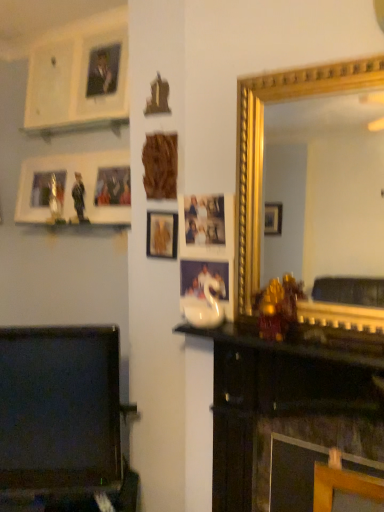
Question: Is black glossy mantle at center taller than wooden carving at center, placed as the 1th picture frame when sorted from front to back?

Choices:
 (A) no
 (B) yes

Answer: (A)

Question: Is black glossy mantle at center aimed at wooden carving at center, marked as the third picture frame in a back-to-front arrangement?

Choices:
 (A) no
 (B) yes

Answer: (A)

Question: Can you confirm if black glossy mantle at center is shorter than wooden carving at center, marked as the third picture frame in a back-to-front arrangement?

Choices:
 (A) yes
 (B) no

Answer: (A)

Question: Does black glossy mantle at center appear on the right side of wooden carving at center, placed as the 2th picture frame when sorted from left to right?

Choices:
 (A) no
 (B) yes

Answer: (B)

Question: Considering the relative sizes of black glossy mantle at center and wooden carving at center, placed as the 2th picture frame when sorted from left to right, in the image provided, is black glossy mantle at center smaller than wooden carving at center, placed as the 2th picture frame when sorted from left to right,?

Choices:
 (A) yes
 (B) no

Answer: (B)

Question: Considering the relative positions of black glossy mantle at center and wooden carving at center, marked as the third picture frame in a back-to-front arrangement, in the image provided, is black glossy mantle at center in front of wooden carving at center, marked as the third picture frame in a back-to-front arrangement,?

Choices:
 (A) yes
 (B) no

Answer: (A)

Question: Is smooth black tv at lower left outside wooden picture frame at upper left, the third picture frame positioned from the right?

Choices:
 (A) yes
 (B) no

Answer: (A)

Question: Is smooth black tv at lower left further to camera compared to wooden picture frame at upper left, which is the 1th picture frame in left-to-right order?

Choices:
 (A) no
 (B) yes

Answer: (A)

Question: Is smooth black tv at lower left closer to camera compared to wooden picture frame at upper left, placed as the third picture frame when sorted from front to back?

Choices:
 (A) no
 (B) yes

Answer: (B)

Question: From the image's perspective, does smooth black tv at lower left appear higher than wooden picture frame at upper left, the third picture frame positioned from the right?

Choices:
 (A) no
 (B) yes

Answer: (A)

Question: From the image's perspective, is smooth black tv at lower left beneath wooden picture frame at upper left, the third picture frame positioned from the right?

Choices:
 (A) no
 (B) yes

Answer: (B)

Question: Is smooth black tv at lower left wider than wooden picture frame at upper left, the third picture frame positioned from the right?

Choices:
 (A) yes
 (B) no

Answer: (A)

Question: Is wooden carving at center, marked as the third picture frame in a back-to-front arrangement, oriented towards smooth black tv at lower left?

Choices:
 (A) yes
 (B) no

Answer: (B)